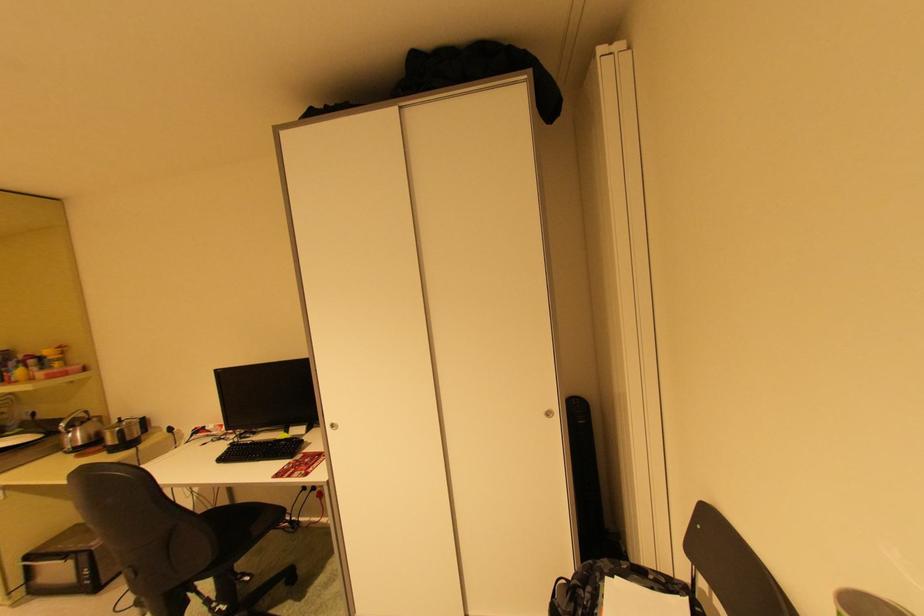
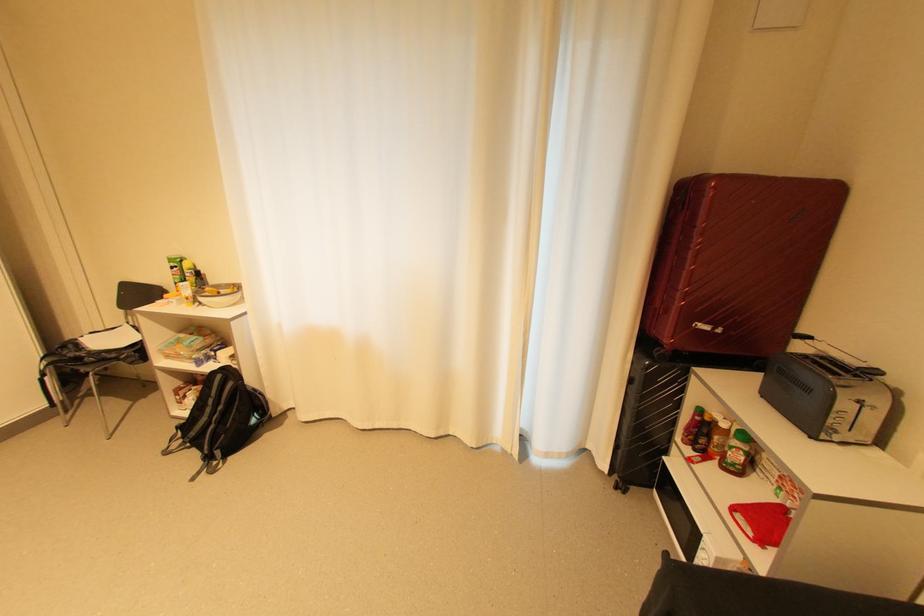
Where in the second image is the point corresponding to the point at 597,589 from the first image?

(79, 346)